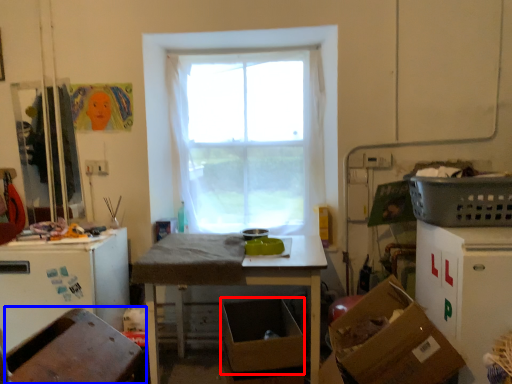
Question: Which point is closer to the camera, cardboard box (highlighted by a red box) or chair (highlighted by a blue box)?

Choices:
 (A) cardboard box
 (B) chair

Answer: (B)